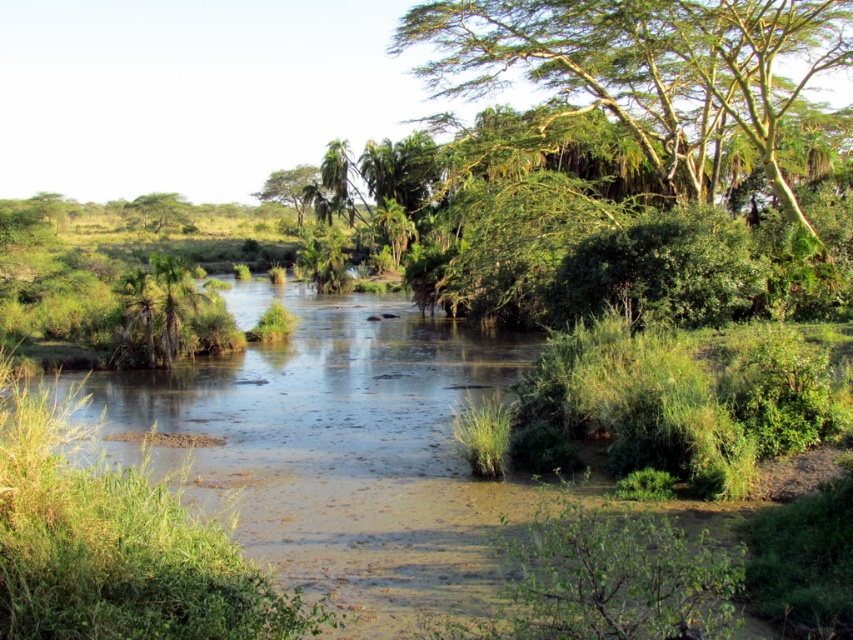
You are a hiker trying to cross the river. You see two trees, the green leafy tree at upper right and the green leafy tree at center. Which tree is farther away from you?

The green leafy tree at upper right is farther away from you because it is 197.79 feet away from the green leafy tree at center, implying that the tree at upper right is further back in the scene.

You are a hiker trying to cross the river. You notice two trees, the green leafy tree at center and the green leafy tree at upper left. Which tree would you see first if you look straight ahead while approaching the river from the left bank?

The green leafy tree at center would be seen first because it is positioned in front of the green leafy tree at upper left, making it closer to your viewpoint as you approach the river from the left bank.

You are a hiker trying to cross the river. You see two trees, the green leafy tree at center and the green leafy tree at upper left. Which tree is bigger and could provide better shade?

The green leafy tree at center is larger in size compared to the green leafy tree at upper left, so it would provide better shade.